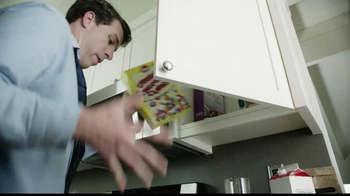
Identify the location of glass. The width and height of the screenshot is (350, 196). (238, 190).